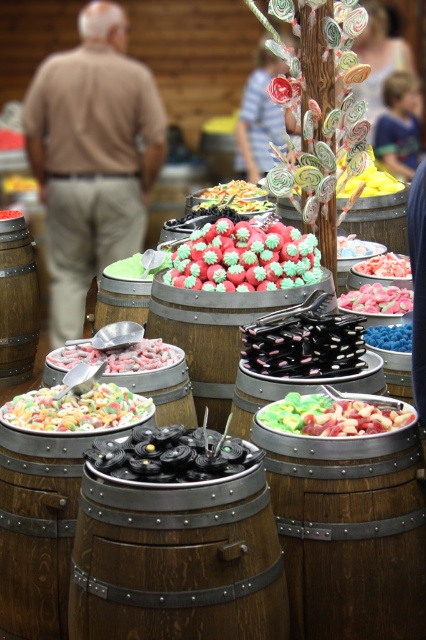
Question: Which point is farther from the camera taking this photo?

Choices:
 (A) (273, 141)
 (B) (373, 301)
 (C) (89, 412)
 (D) (354, 234)

Answer: (A)

Question: Which of the following is the farthest from the observer?

Choices:
 (A) (241, 170)
 (B) (74, 355)

Answer: (A)

Question: Is brown wooden barrel at center bigger than blue matte candy at center?

Choices:
 (A) yes
 (B) no

Answer: (A)

Question: Is green frosted strawberries at center thinner than blonde hair at upper right?

Choices:
 (A) yes
 (B) no

Answer: (B)

Question: Does brown cotton shirt at upper left appear on the left side of striped shirt at center?

Choices:
 (A) no
 (B) yes

Answer: (B)

Question: Which object is positioned farthest from the white candy at center?

Choices:
 (A) blue matte candy at center
 (B) brown cotton shirt at upper left
 (C) blonde hair at upper right
 (D) shiny pink candy at center

Answer: (C)